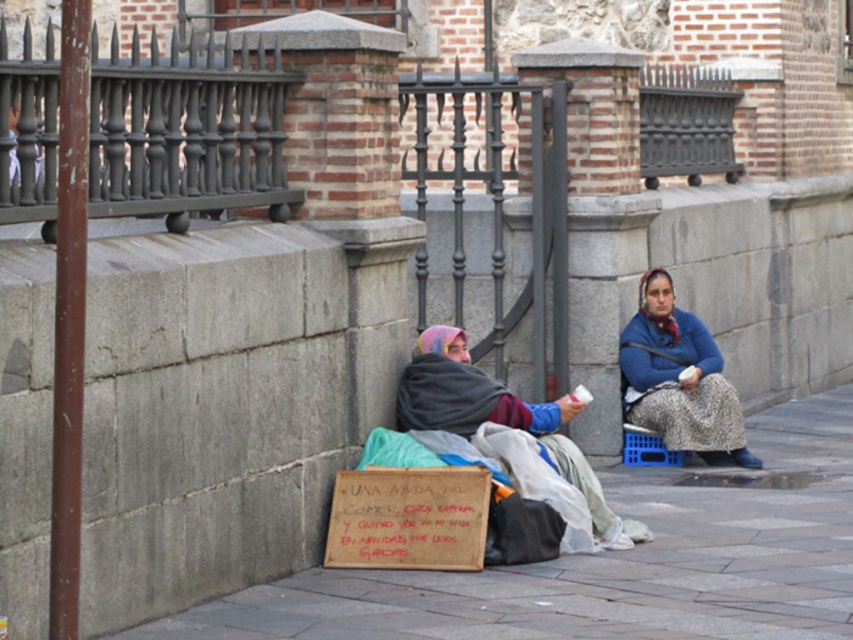
Between point (426, 513) and point (410, 371), which one is positioned behind?

The point (410, 371) is more distant.

You are a GUI agent. You are given a task and a screenshot of the screen. Output one action in this format:
    pyautogui.click(x=<x>, y=<y>)
    Task: Click on the brown cardboard sign at lower center
    The height and width of the screenshot is (640, 853).
    Given the screenshot: What is the action you would take?
    pyautogui.click(x=408, y=518)

Where is `brown cardboard sign at lower center`? This screenshot has height=640, width=853. brown cardboard sign at lower center is located at coordinates (408, 518).

Does point (730, 477) come behind point (653, 326)?

No, (730, 477) is in front of (653, 326).

Can you confirm if gray concrete pavement at lower center is positioned to the right of blue fabric headscarf at lower center?

Correct, you'll find gray concrete pavement at lower center to the right of blue fabric headscarf at lower center.

Who is more distant from viewer, (770, 540) or (682, 320)?

Positioned behind is point (682, 320).

At what (x,y) coordinates should I click in order to perform the action: click on gray concrete pavement at lower center. Please return your answer as a coordinate pair (x, y). Looking at the image, I should click on (614, 563).

This screenshot has width=853, height=640. What do you see at coordinates (679, 380) in the screenshot? I see `blue fabric headscarf at lower center` at bounding box center [679, 380].

Identify the location of blue fabric headscarf at lower center. This screenshot has height=640, width=853. (679, 380).

Describe the element at coordinates (679, 380) in the screenshot. I see `blue fabric headscarf at lower center` at that location.

You are a GUI agent. You are given a task and a screenshot of the screen. Output one action in this format:
    pyautogui.click(x=<x>, y=<y>)
    Task: Click on the blue fabric headscarf at lower center
    
    Given the screenshot: What is the action you would take?
    pyautogui.click(x=679, y=380)